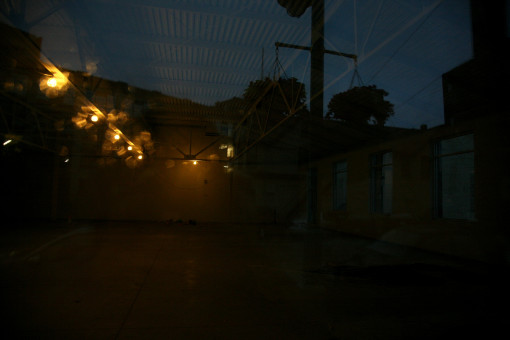
The image size is (510, 340). What are the coordinates of `stairs` in the screenshot? It's located at (301, 218).